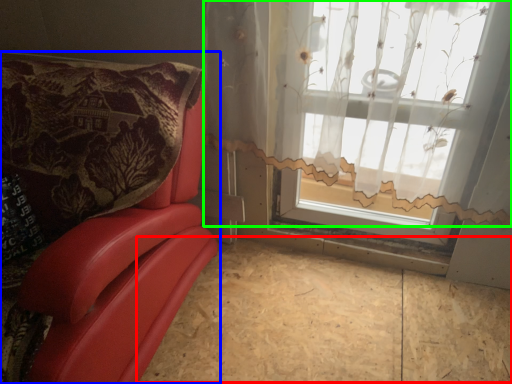
Question: Based on their relative distances, which object is farther from plywood (highlighted by a red box)? Choose from furniture (highlighted by a blue box) and curtain (highlighted by a green box).

Choices:
 (A) furniture
 (B) curtain

Answer: (B)